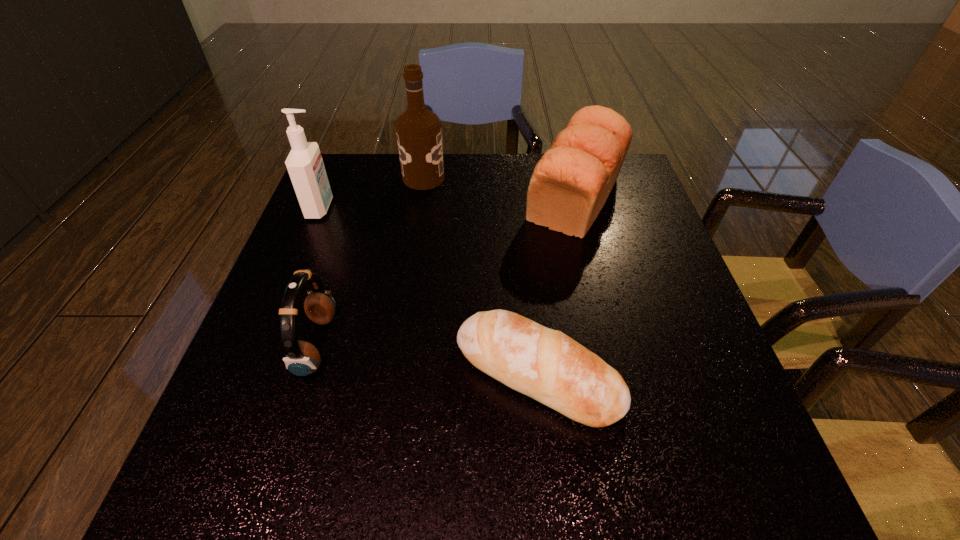
Identify the location of free space located 0.180m on the left of the taller bread. The width and height of the screenshot is (960, 540). (458, 198).

I want to click on vacant space located on the ear cup of the headset, so click(x=461, y=345).

At what (x,y) coordinates should I click in order to perform the action: click on free location located 0.160m on the left of the shorter bread. Please return your answer as a coordinate pair (x, y). This screenshot has width=960, height=540. Looking at the image, I should click on (372, 374).

The image size is (960, 540). I want to click on alcohol at the far edge, so click(x=418, y=130).

I want to click on cleansing agent that is positioned at the far edge, so click(305, 166).

Locate an element on the screen. The height and width of the screenshot is (540, 960). bread that is at the far edge is located at coordinates (570, 184).

Where is `cleansing agent that is at the left edge`? This screenshot has width=960, height=540. cleansing agent that is at the left edge is located at coordinates (305, 166).

Find the location of a particular element. This screenshot has height=540, width=960. headset at the left edge is located at coordinates (302, 358).

Find the location of a particular element. The height and width of the screenshot is (540, 960). object situated at the right edge is located at coordinates (570, 184).

The image size is (960, 540). I want to click on object positioned at the far left corner, so click(305, 166).